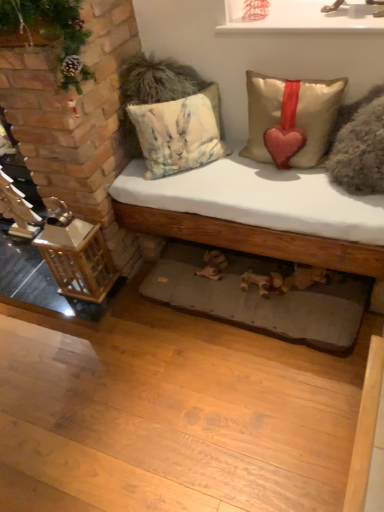
Question: Is gray fabric mat at lower center further to the viewer compared to white cotton bed at center?

Choices:
 (A) no
 (B) yes

Answer: (B)

Question: Considering the relative sizes of gray fabric mat at lower center and white cotton bed at center in the image provided, is gray fabric mat at lower center bigger than white cotton bed at center?

Choices:
 (A) yes
 (B) no

Answer: (B)

Question: Is gray fabric mat at lower center to the left of white cotton bed at center from the viewer's perspective?

Choices:
 (A) no
 (B) yes

Answer: (B)

Question: Is gray fabric mat at lower center not within white cotton bed at center?

Choices:
 (A) no
 (B) yes

Answer: (A)

Question: Are gray fabric mat at lower center and white cotton bed at center far apart?

Choices:
 (A) yes
 (B) no

Answer: (B)

Question: Does gray fabric mat at lower center come in front of white cotton bed at center?

Choices:
 (A) yes
 (B) no

Answer: (B)

Question: Is satin gold pillow with red heart at upper center, positioned as the 2th pillow in left-to-right order, facing away from watercolor fabric pillow at center, which is the 1th pillow in left-to-right order?

Choices:
 (A) yes
 (B) no

Answer: (B)

Question: From the image's perspective, does satin gold pillow with red heart at upper center, positioned as the 2th pillow in left-to-right order, appear higher than watercolor fabric pillow at center, which is the 1th pillow in left-to-right order?

Choices:
 (A) yes
 (B) no

Answer: (B)

Question: Is satin gold pillow with red heart at upper center, positioned as the 2th pillow in left-to-right order, at the right side of watercolor fabric pillow at center, the third pillow from the right?

Choices:
 (A) no
 (B) yes

Answer: (B)

Question: Does satin gold pillow with red heart at upper center, the second pillow from the right, come behind watercolor fabric pillow at center, which is the 1th pillow in left-to-right order?

Choices:
 (A) yes
 (B) no

Answer: (B)

Question: Is satin gold pillow with red heart at upper center, positioned as the 2th pillow in left-to-right order, shorter than watercolor fabric pillow at center, the third pillow from the right?

Choices:
 (A) no
 (B) yes

Answer: (B)

Question: From a real-world perspective, is satin gold pillow with red heart at upper center, positioned as the 2th pillow in left-to-right order, located beneath watercolor fabric pillow at center, the third pillow from the right?

Choices:
 (A) no
 (B) yes

Answer: (A)

Question: Is watercolor fabric pillow at center, the third pillow from the right, closer to camera compared to white glossy shelf at upper center?

Choices:
 (A) no
 (B) yes

Answer: (A)